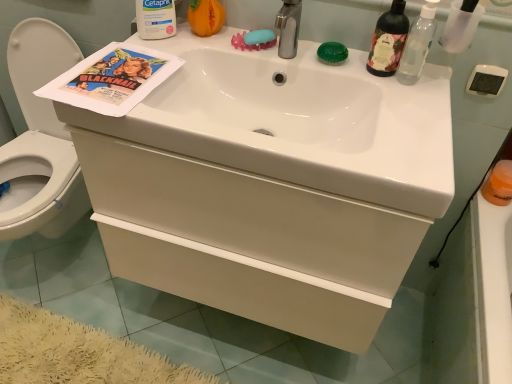
The width and height of the screenshot is (512, 384). What are the coordinates of `free spot in front of translucent glass bottle at upper right, the second bottle in the left-to-right sequence` in the screenshot? It's located at (407, 104).